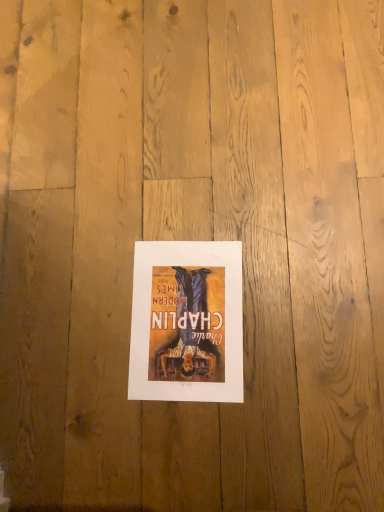
Locate an element on the screen. vacant space underneath matte paper poster at center (from a real-world perspective) is located at coordinates (185, 311).